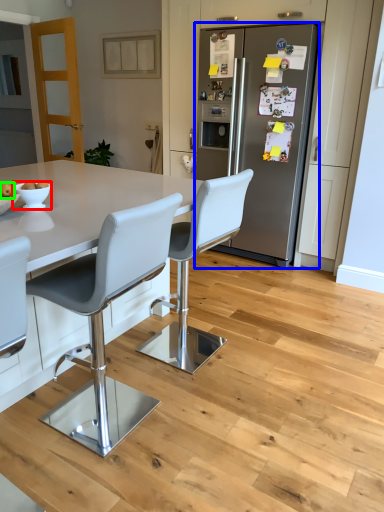
Question: Considering the real-world distances, which object is closest to bowl (highlighted by a red box)? refrigerator (highlighted by a blue box) or fruit (highlighted by a green box).

Choices:
 (A) refrigerator
 (B) fruit

Answer: (B)